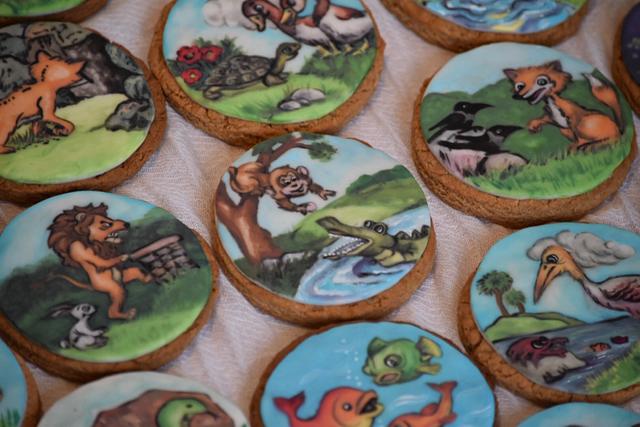
This screenshot has width=640, height=427. Identify the location of painted coaster. (81, 129), (227, 78), (461, 19), (506, 123), (140, 263), (155, 401), (337, 399), (515, 332), (589, 423).